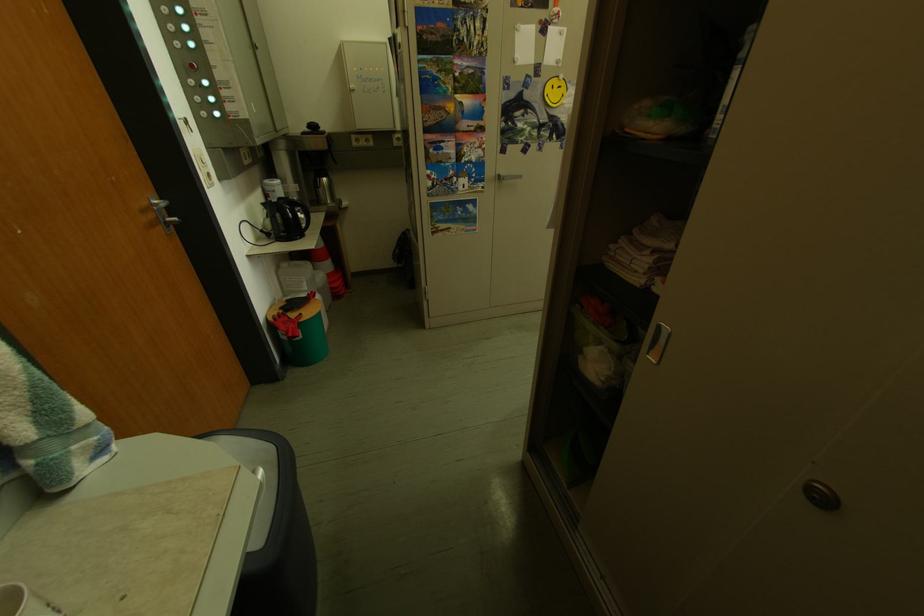
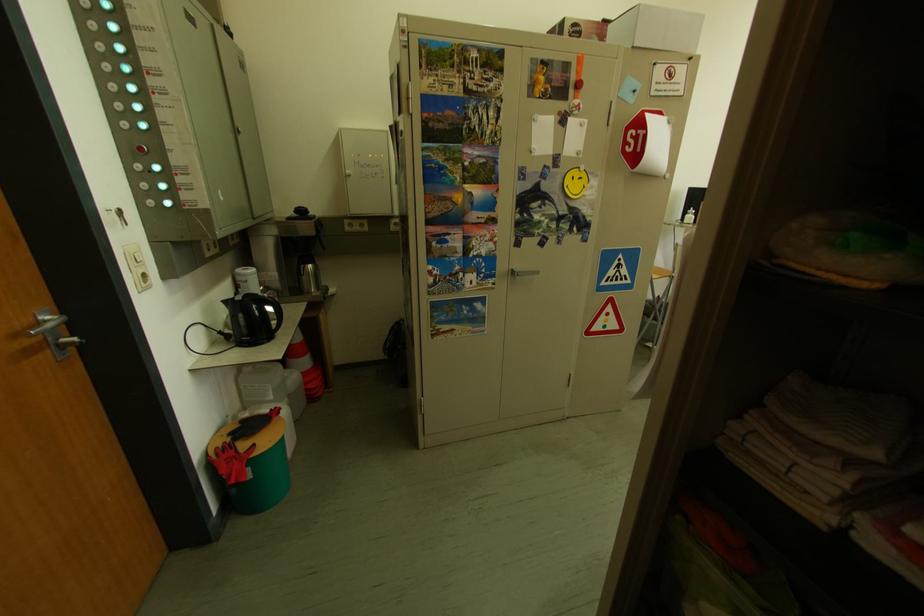
Question: The images are taken continuously from a first-person perspective. In which direction are you moving?

Choices:
 (A) Left
 (B) Right
 (C) Forward
 (D) Backward

Answer: (C)